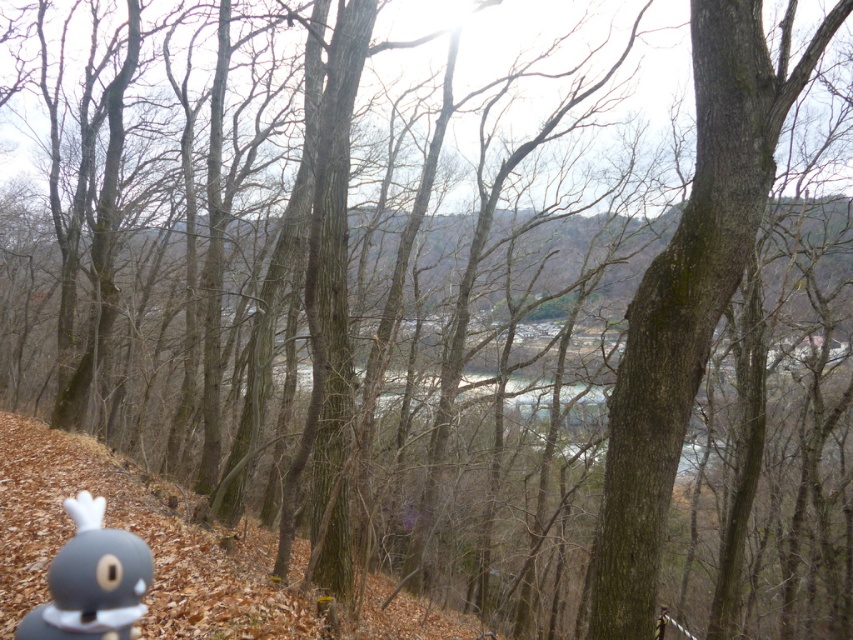
Does brown rough bark tree at center have a larger size compared to gray matte toy at lower left?

Correct, brown rough bark tree at center is larger in size than gray matte toy at lower left.

The width and height of the screenshot is (853, 640). What do you see at coordinates (689, 292) in the screenshot? I see `brown rough bark tree at center` at bounding box center [689, 292].

Image resolution: width=853 pixels, height=640 pixels. Find the location of `brown rough bark tree at center`. brown rough bark tree at center is located at coordinates (689, 292).